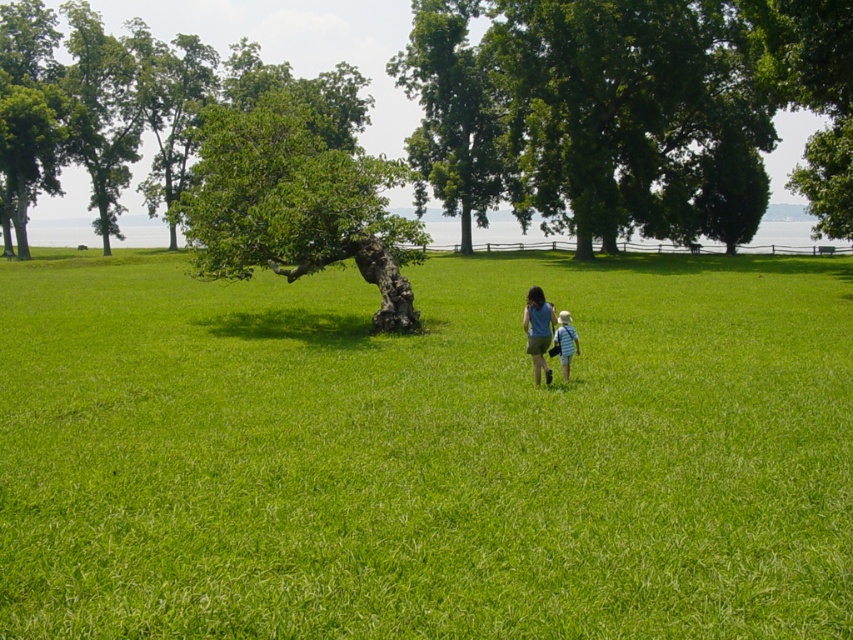
Is point (737, 72) more distant than point (280, 148)?

Yes, point (737, 72) is farther from viewer.

Which is above, green leafy tree at center or green rough bark tree at center?

green leafy tree at center

In order to click on green leafy tree at center in this screenshot , I will do click(587, 115).

Where is `green leafy tree at center`? green leafy tree at center is located at coordinates (587, 115).

Which is above, green grass at center or green rough bark tree at center?

green rough bark tree at center

Does point (498, 380) come behind point (317, 220)?

No, (498, 380) is in front of (317, 220).

Where is `green grass at center`? This screenshot has width=853, height=640. green grass at center is located at coordinates (425, 452).

Does green leafy tree at center come in front of striped cotton shirt at center?

No, it is behind striped cotton shirt at center.

Which is behind, point (593, 26) or point (561, 371)?

The point (593, 26) is behind.

Is point (653, 20) farther from camera compared to point (577, 355)?

Yes, it is behind point (577, 355).

I want to click on green leafy tree at center, so click(587, 115).